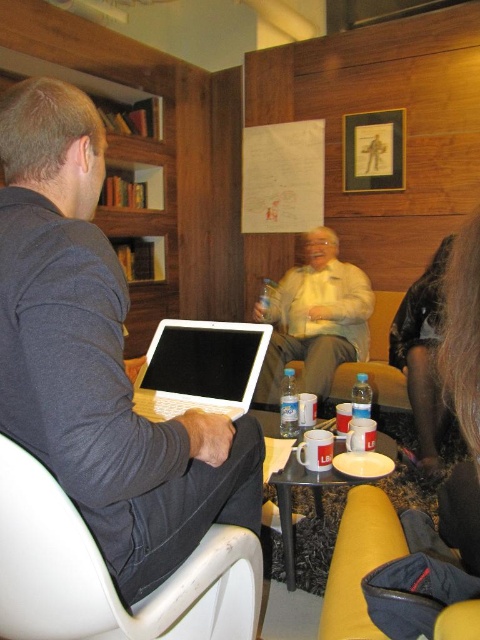
Question: Is white plastic laptop at left behind black plastic table at lower center?

Choices:
 (A) yes
 (B) no

Answer: (B)

Question: Estimate the real-world distances between objects in this image. Which object is closer to the matte white shirt at center?

Choices:
 (A) black silky hair at lower right
 (B) black plastic table at lower center

Answer: (B)

Question: Is matte black laptop at left to the right of white plastic armchair at left from the viewer's perspective?

Choices:
 (A) yes
 (B) no

Answer: (B)

Question: Based on their relative distances, which object is nearer to the matte white shirt at center?

Choices:
 (A) velvet black purse at lower right
 (B) wooden bookshelf at left
 (C) yellow fabric armchair at lower right

Answer: (A)

Question: Is matte black laptop at left below yellow fabric armchair at lower right?

Choices:
 (A) yes
 (B) no

Answer: (B)

Question: Which object is the farthest from the wooden bookshelf at left?

Choices:
 (A) matte black laptop at left
 (B) matte white shirt at center
 (C) white plastic armchair at left

Answer: (C)